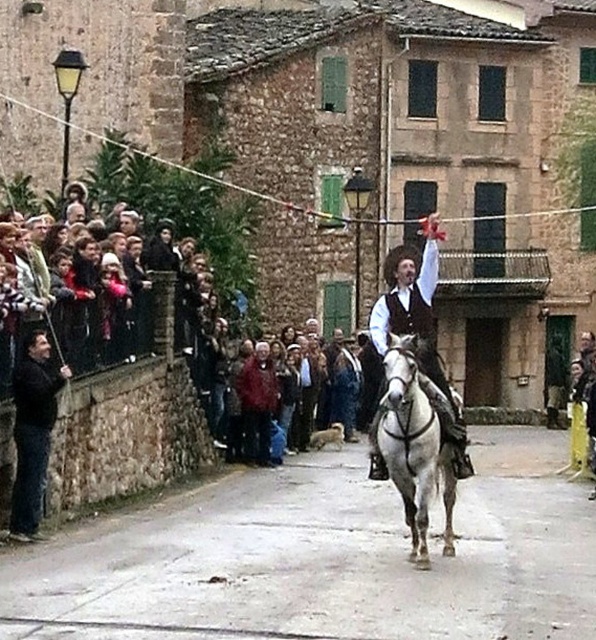
Who is more distant from viewer, (1, 376) or (377, 438)?

The point (1, 376) is behind.

This screenshot has width=596, height=640. In order to click on dark clothing crowd at left in this screenshot , I will do `click(114, 314)`.

Who is more forward, (131,352) or (415,490)?

Point (415,490)

Locate an element on the screen. dark clothing crowd at left is located at coordinates (114, 314).

Is point (49, 432) positioned before point (256, 358)?

Yes, point (49, 432) is closer to viewer.

Who is lower down, black leather jacket at left or red wool sweater at center?

red wool sweater at center is lower down.

Where is `black leather jacket at left`? The height and width of the screenshot is (640, 596). black leather jacket at left is located at coordinates (32, 433).

Locate an element on the screen. black leather jacket at left is located at coordinates coord(32,433).

Is dark clothing crowd at left below red wool sweater at center?

Incorrect, dark clothing crowd at left is not positioned below red wool sweater at center.

Who is more forward, [57,253] or [250,428]?

Point [57,253]

Identify the location of dark clothing crowd at left. This screenshot has width=596, height=640. (114, 314).